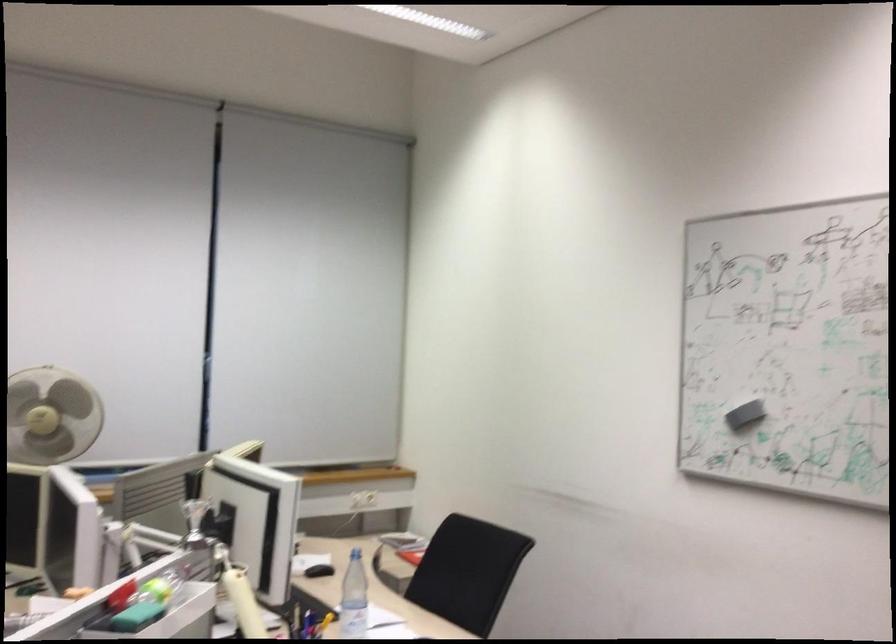
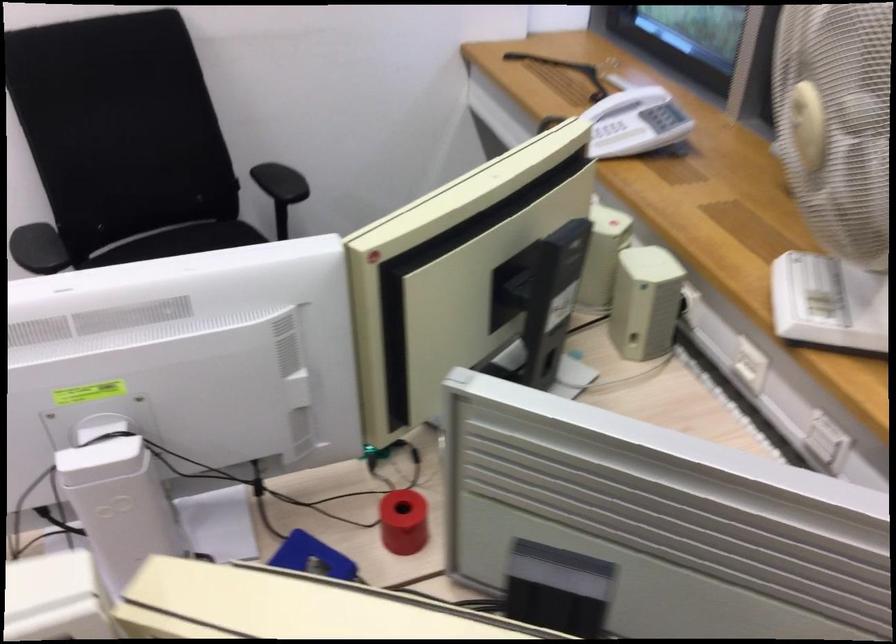
The point at [90,556] is marked in the first image. Where is the corresponding point in the second image?

(118, 500)